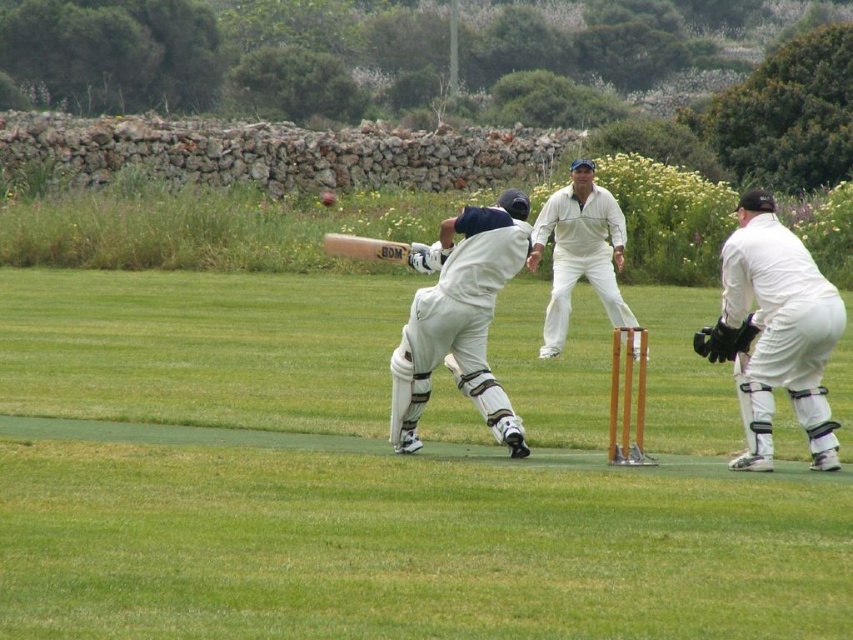
Question: Does white cloth cricket bat at center have a larger size compared to wooden bat at center?

Choices:
 (A) no
 (B) yes

Answer: (A)

Question: Where is white matte cricket bat at center located in relation to white cloth cricket bat at center in the image?

Choices:
 (A) above
 (B) below

Answer: (B)

Question: Based on their relative distances, which object is nearer to the wooden bat at center?

Choices:
 (A) white matte cricket bat at center
 (B) white matte cricket gear at right

Answer: (A)

Question: Which point is farther to the camera?

Choices:
 (A) white cloth cricket bat at center
 (B) white matte cricket gear at right
 (C) white matte cricket bat at center

Answer: (A)

Question: Which of the following is the farthest from the observer?

Choices:
 (A) (473, 225)
 (B) (415, 250)

Answer: (B)

Question: Can you confirm if white matte cricket gear at right is positioned above white cloth cricket bat at center?

Choices:
 (A) yes
 (B) no

Answer: (B)